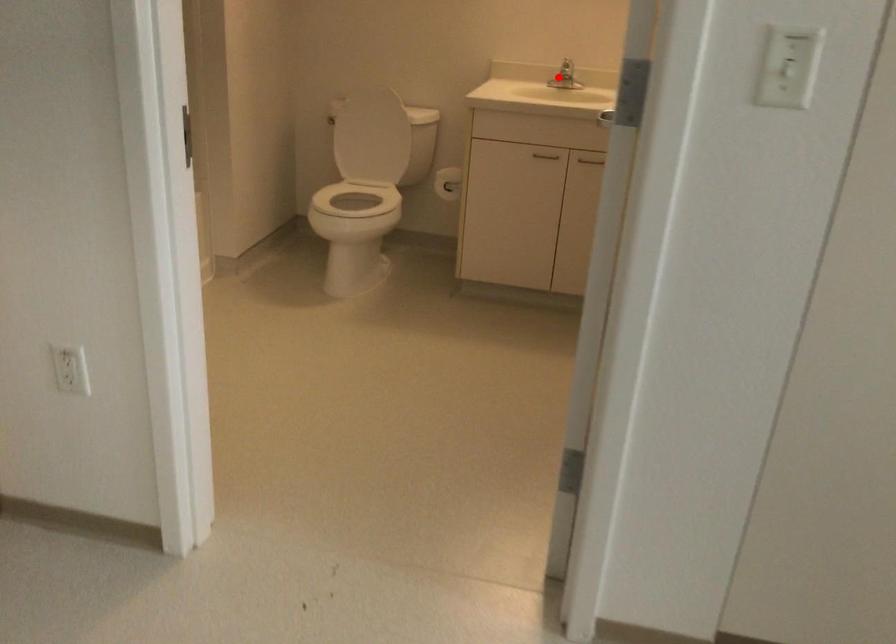
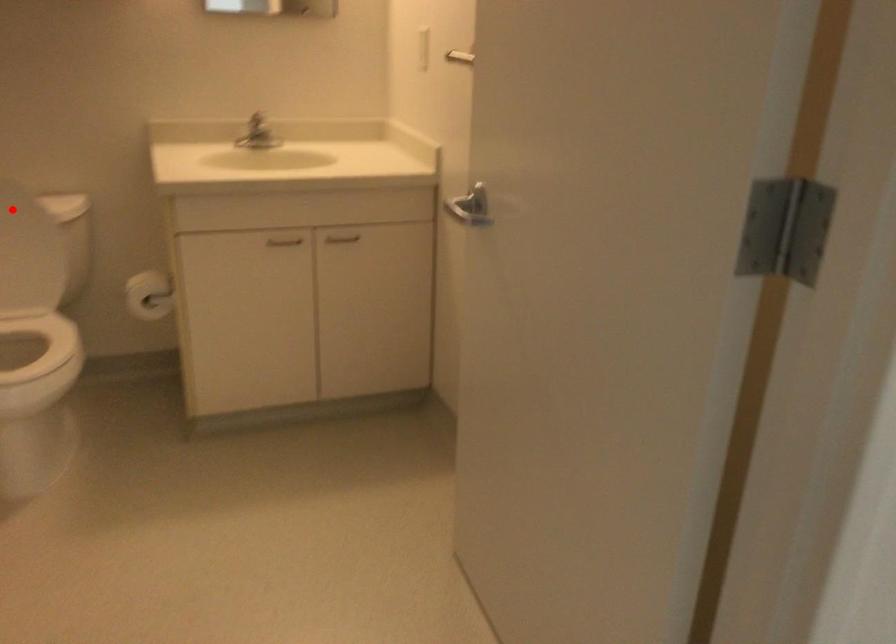
I am providing you with two images of the same scene from different viewpoints. A red point is marked on the first image and another point is marked on the second image. Is the red point in image1 aligned with the point shown in image2?

No